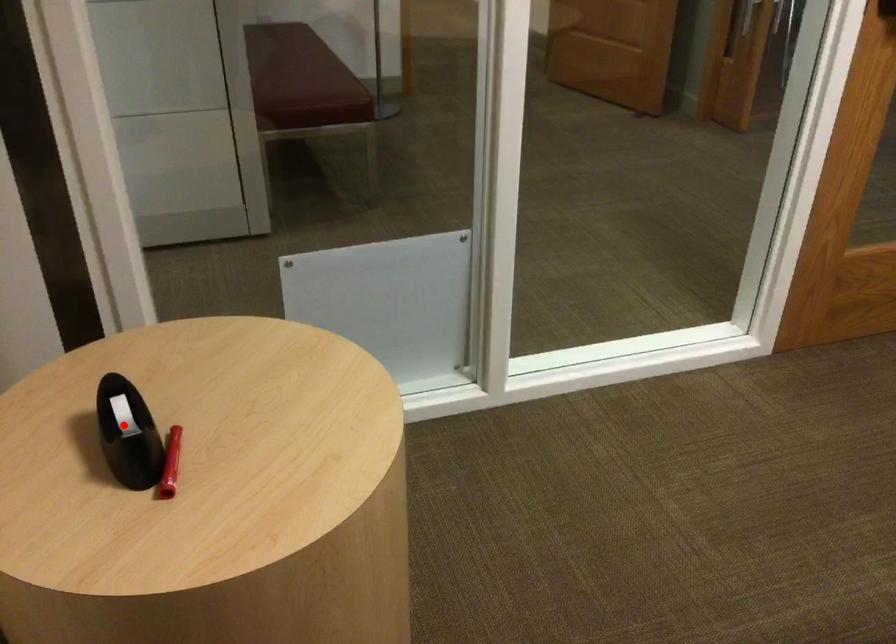
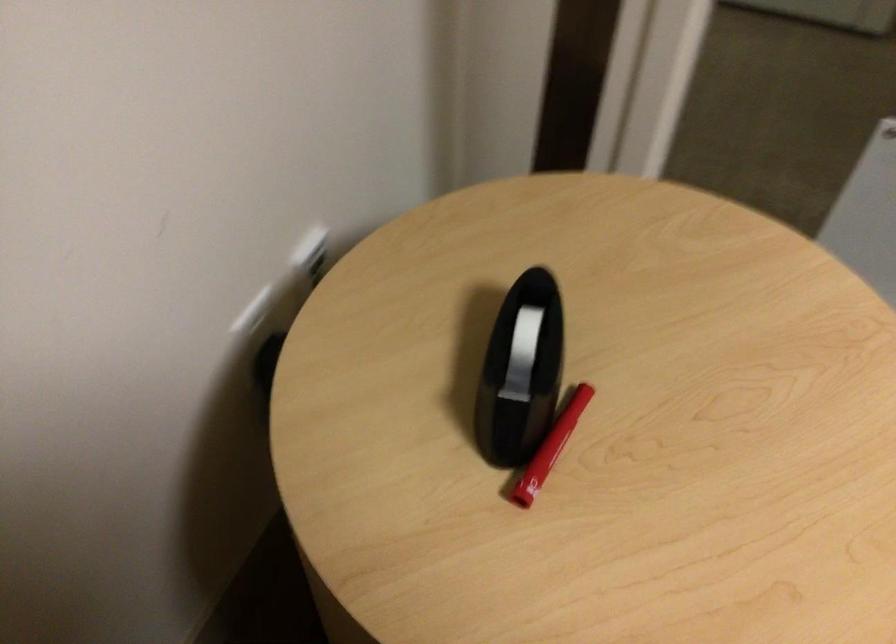
In the second image, find the point that corresponds to the highlighted location in the first image.

(521, 354)